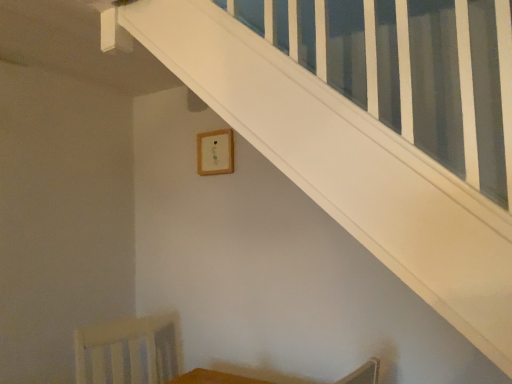
Question: Is white wood swivel chair at lower left to the right of wooden table at lower center from the viewer's perspective?

Choices:
 (A) no
 (B) yes

Answer: (A)

Question: Is white wood swivel chair at lower left far away from wooden table at lower center?

Choices:
 (A) no
 (B) yes

Answer: (A)

Question: Does white wood swivel chair at lower left have a greater height compared to wooden table at lower center?

Choices:
 (A) yes
 (B) no

Answer: (A)

Question: Is white wood swivel chair at lower left wider than wooden table at lower center?

Choices:
 (A) yes
 (B) no

Answer: (A)

Question: Are white wood swivel chair at lower left and wooden table at lower center beside each other?

Choices:
 (A) yes
 (B) no

Answer: (B)

Question: From the image's perspective, is wooden frame at upper center positioned above or below white wood swivel chair at lower left?

Choices:
 (A) below
 (B) above

Answer: (B)

Question: Is point coord(227,150) closer or farther from the camera than point coord(159,342)?

Choices:
 (A) farther
 (B) closer

Answer: (B)

Question: Considering the relative positions of wooden frame at upper center and white wood swivel chair at lower left in the image provided, is wooden frame at upper center to the left or to the right of white wood swivel chair at lower left?

Choices:
 (A) right
 (B) left

Answer: (A)

Question: Would you say wooden frame at upper center is inside or outside white wood swivel chair at lower left?

Choices:
 (A) outside
 (B) inside

Answer: (A)

Question: Considering their positions, is white wood swivel chair at lower left located in front of or behind wooden table at lower center?

Choices:
 (A) front
 (B) behind

Answer: (B)

Question: Is white wood swivel chair at lower left wider or thinner than wooden table at lower center?

Choices:
 (A) wide
 (B) thin

Answer: (A)

Question: Which is correct: white wood swivel chair at lower left is inside wooden table at lower center, or outside of it?

Choices:
 (A) outside
 (B) inside

Answer: (A)

Question: Based on their sizes in the image, would you say white wood swivel chair at lower left is bigger or smaller than wooden table at lower center?

Choices:
 (A) small
 (B) big

Answer: (B)

Question: From a real-world perspective, relative to wooden table at lower center, is wooden frame at upper center vertically above or below?

Choices:
 (A) above
 (B) below

Answer: (A)

Question: Is wooden frame at upper center situated inside wooden table at lower center or outside?

Choices:
 (A) inside
 (B) outside

Answer: (B)